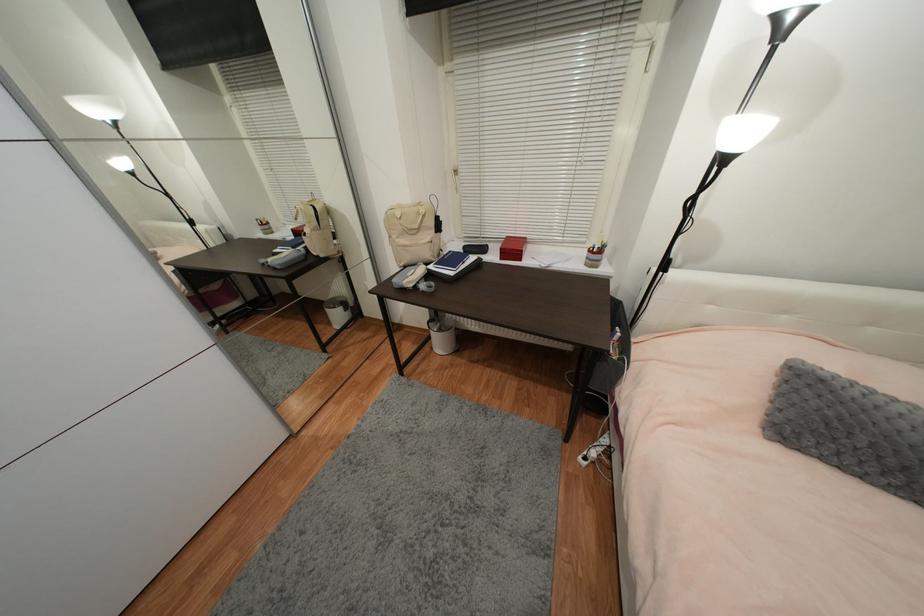
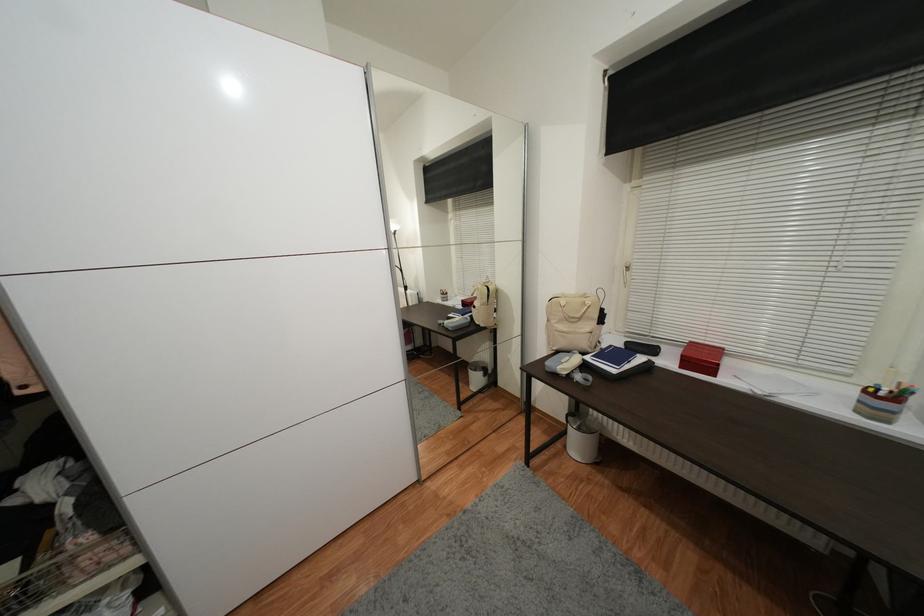
The point at (593,253) is marked in the first image. Where is the corresponding point in the second image?

(871, 392)